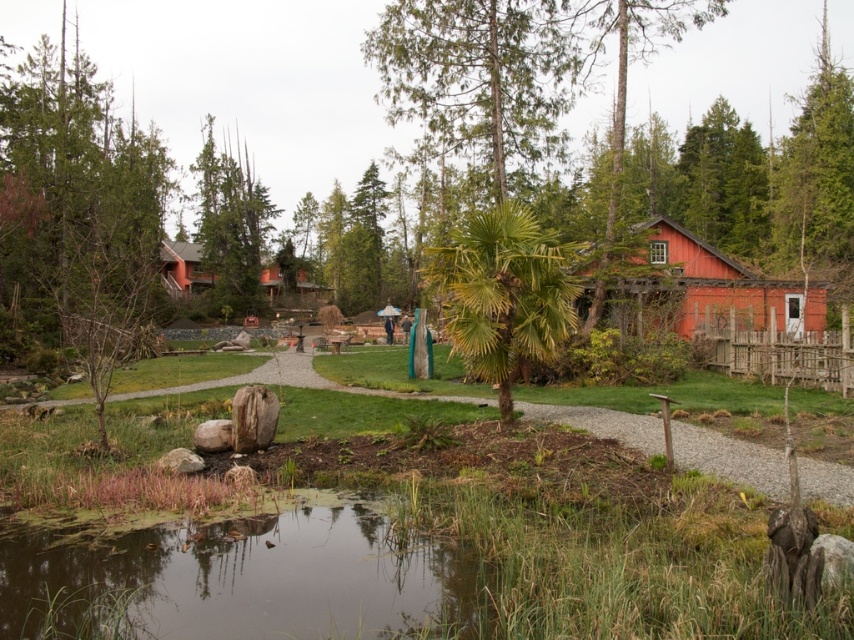
Question: In this image, where is red wooden hut at center located relative to green textured tree at upper left?

Choices:
 (A) right
 (B) left

Answer: (A)

Question: Which of the following is the closest to the observer?

Choices:
 (A) (246, 195)
 (B) (692, 320)
 (C) (461, 243)
 (D) (420, 547)

Answer: (D)

Question: Which is farther from the green leafy palm tree at center?

Choices:
 (A) red wooden hut at center
 (B) green grassy pond at lower center

Answer: (A)

Question: Which is farther from the green grassy pond at lower center?

Choices:
 (A) green leafy palm tree at center
 (B) red wooden hut at center
 (C) green textured tree at upper left

Answer: (C)

Question: Is green grassy pond at lower center closer to camera compared to red wooden hut at center?

Choices:
 (A) yes
 (B) no

Answer: (A)

Question: Is green grassy pond at lower center in front of green leafy palm tree at center?

Choices:
 (A) no
 (B) yes

Answer: (B)